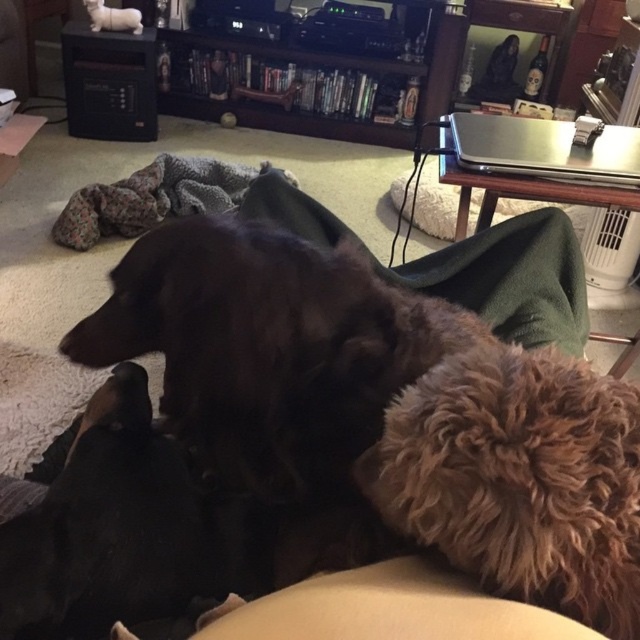
In the scene shown: You are standing in the living room and want to place a new painting on the wall. The painting must be placed exactly at the 2D location of the green soft blanket at center. Where should you place the painting?

Place the painting at the 2D coordinates of the green soft blanket at center, which is at point [509,278].

You are a cat owner who wants to place your white plush cat at upper left on top of the wooden entertainment center at upper center. Is there enough space for the cat to be placed there?

The wooden entertainment center at upper center is positioned under white plush cat at upper left, so the cat is already placed on top of the entertainment center. Therefore, there is sufficient space.

You are standing in the living room and see two points marked in the image. The first point is at coordinate point(378, 288) and the second point is at coordinate point(124, 22). Which point is closer to you?

Point point(378, 288) is in front of point point(124, 22), so it is closer to you.